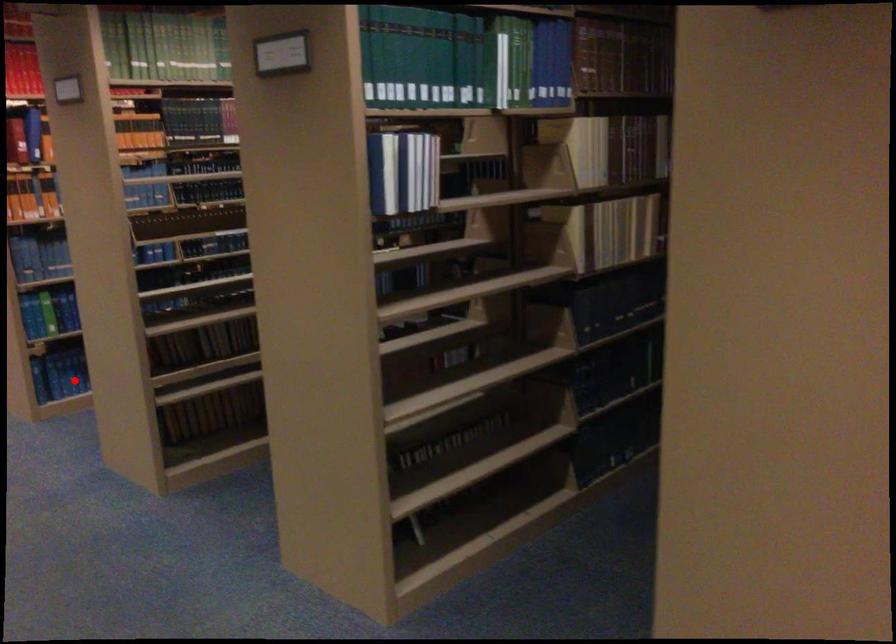
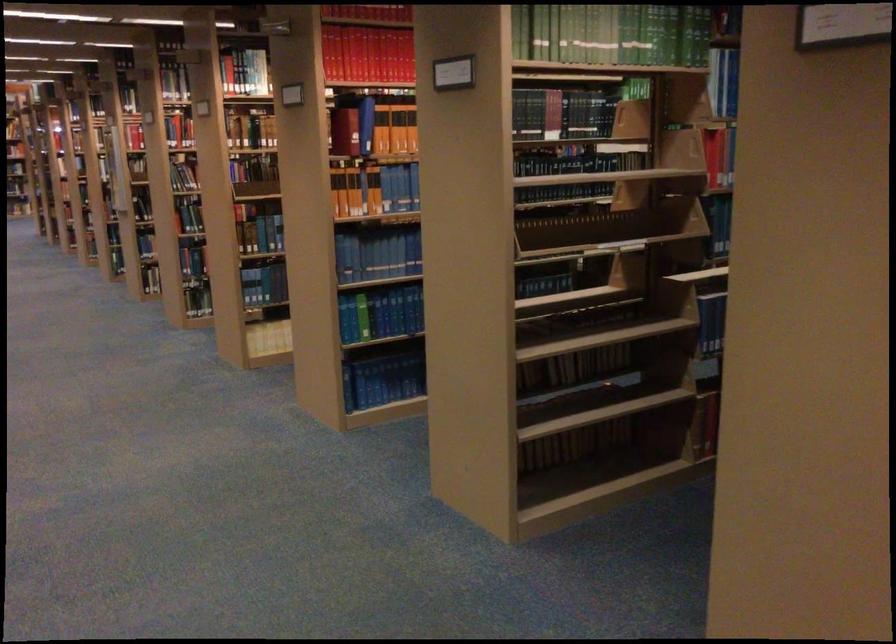
Question: I am providing you with two images of the same scene from different viewpoints. A red point is marked on the first image. Is the red point's position out of view in image 2?

Choices:
 (A) Yes
 (B) No

Answer: (B)